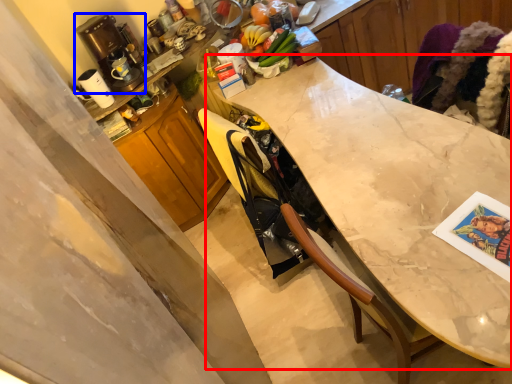
Question: Which object is further to the camera taking this photo, countertop (highlighted by a red box) or coffee machine (highlighted by a blue box)?

Choices:
 (A) countertop
 (B) coffee machine

Answer: (B)